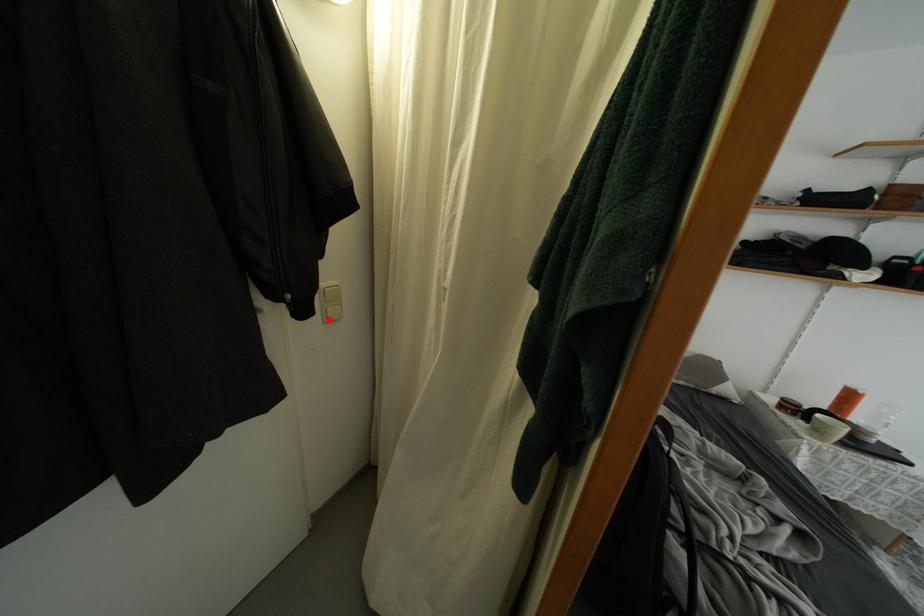
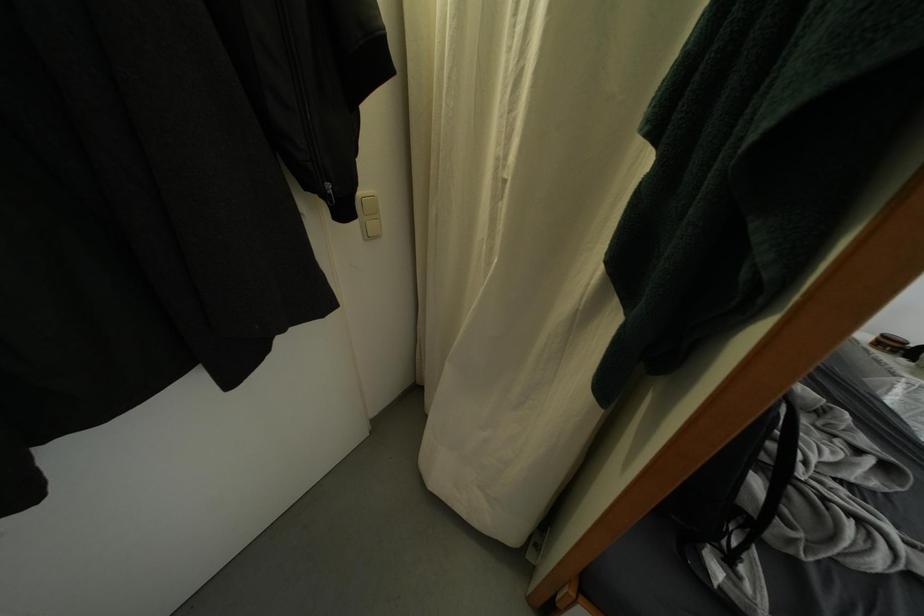
The point at the highlighted location is marked in the first image. Where is the corresponding point in the second image?

(368, 236)